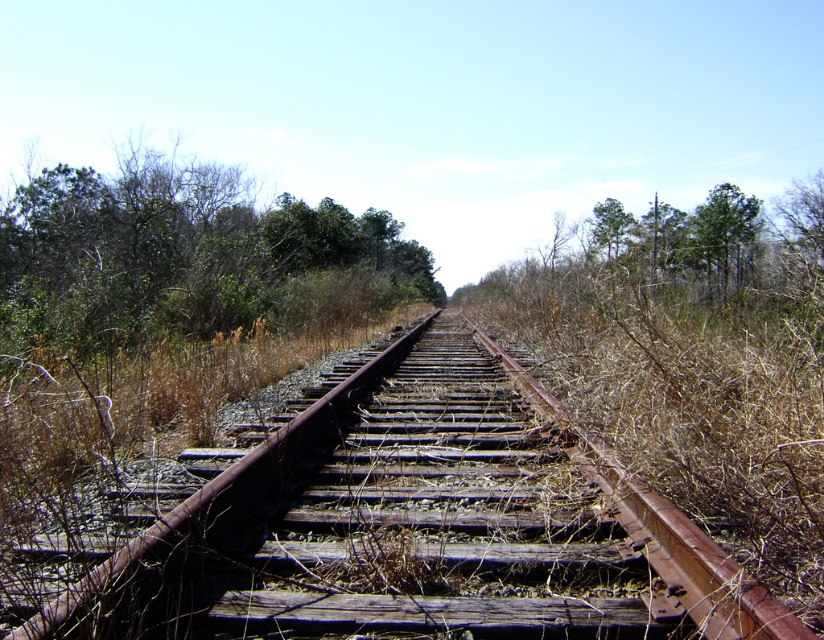
You are standing at the starting point of the abandoned railway track and want to walk towards the distant point. Which of the two points, point (586, 518) or point (701, 212), is closer to your current position?

Point (586, 518) is closer to your current position because it is in front of point (701, 212) along the railway track.

You are a bird looking for a nesting spot. You see two options in the image, the green leafy trees at upper center and the green leafy tree at upper right. Which tree would you choose if you prefer nesting in the taller one?

The green leafy tree at upper right is taller than the green leafy trees at upper center, so you should choose the green leafy tree at upper right for nesting.